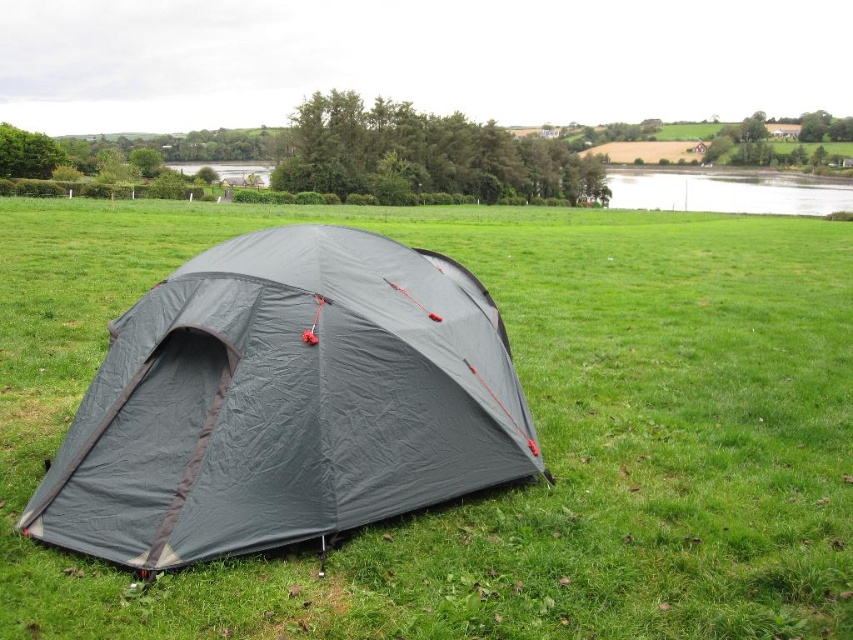
Where is `dark gray fabric tent at center`? This screenshot has height=640, width=853. dark gray fabric tent at center is located at coordinates (285, 401).

Can you confirm if dark gray fabric tent at center is taller than smooth water at upper right?

Incorrect, dark gray fabric tent at center's height is not larger of smooth water at upper right's.

Which is behind, point (427, 493) or point (816, 195)?

Positioned behind is point (816, 195).

Where is `dark gray fabric tent at center`? dark gray fabric tent at center is located at coordinates (285, 401).